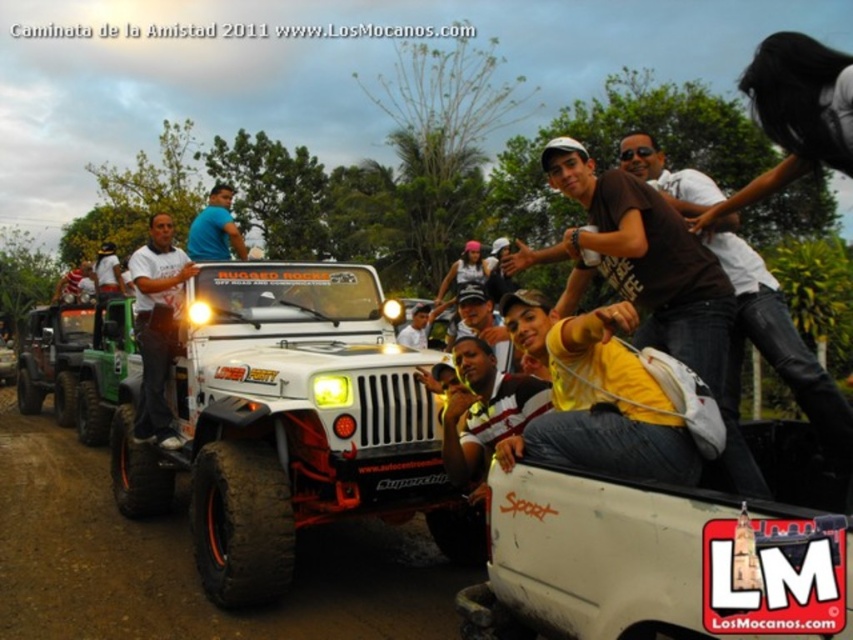
You are a photographer standing at the edge of the scene. You want to take a photo of the white matte truck bed at lower right and the black rubber tire at center. Which object should you focus on first to ensure both are in clear view?

You should focus on the white matte truck bed at lower right first because it is closer to the viewer than the black rubber tire at center, ensuring both objects remain in clear focus when adjusting the camera settings.

You are a photographer planning to take a picture of the white matte truck bed at lower right and the brown leather shirt at upper right. Which object should you focus on first if you want to capture both in the same frame without moving the camera?

You should focus on the white matte truck bed at lower right first because it is larger in size compared to the brown leather shirt at upper right, ensuring it is in focus while the smaller object may still be within the depth of field.